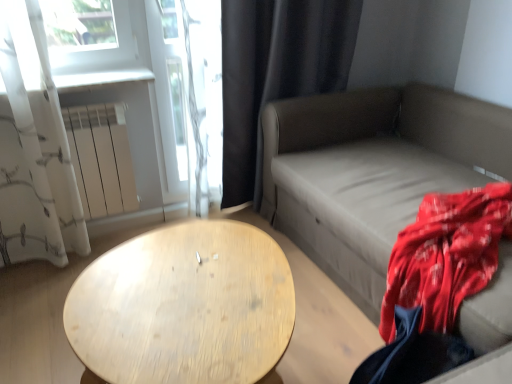
Question: Is black fabric curtain at upper right, the 2th curtain positioned from the left, thinner than matte gray couch at right?

Choices:
 (A) no
 (B) yes

Answer: (B)

Question: Is matte gray couch at right at the back of black fabric curtain at upper right, the 2th curtain positioned from the left?

Choices:
 (A) yes
 (B) no

Answer: (B)

Question: From a real-world perspective, is black fabric curtain at upper right, the first curtain viewed from the right, positioned over matte gray couch at right based on gravity?

Choices:
 (A) no
 (B) yes

Answer: (B)

Question: Could you tell me if black fabric curtain at upper right, the first curtain viewed from the right, is turned towards matte gray couch at right?

Choices:
 (A) no
 (B) yes

Answer: (B)

Question: From the image's perspective, would you say black fabric curtain at upper right, the 2th curtain positioned from the left, is shown under matte gray couch at right?

Choices:
 (A) no
 (B) yes

Answer: (A)

Question: Can you confirm if black fabric curtain at upper right, the first curtain viewed from the right, is smaller than matte gray couch at right?

Choices:
 (A) yes
 (B) no

Answer: (A)

Question: Is black fabric curtain at upper right, the first curtain viewed from the right, surrounding light wood/texture table at center?

Choices:
 (A) no
 (B) yes

Answer: (A)

Question: From the image's perspective, is black fabric curtain at upper right, the first curtain viewed from the right, below light wood/texture table at center?

Choices:
 (A) no
 (B) yes

Answer: (A)

Question: Is the position of black fabric curtain at upper right, the first curtain viewed from the right, less distant than that of light wood/texture table at center?

Choices:
 (A) no
 (B) yes

Answer: (A)

Question: From a real-world perspective, is black fabric curtain at upper right, the 2th curtain positioned from the left, positioned under light wood/texture table at center based on gravity?

Choices:
 (A) no
 (B) yes

Answer: (A)

Question: Considering the relative sizes of black fabric curtain at upper right, the first curtain viewed from the right, and light wood/texture table at center in the image provided, is black fabric curtain at upper right, the first curtain viewed from the right, taller than light wood/texture table at center?

Choices:
 (A) yes
 (B) no

Answer: (A)

Question: Is black fabric curtain at upper right, the first curtain viewed from the right, smaller than light wood/texture table at center?

Choices:
 (A) no
 (B) yes

Answer: (A)

Question: Is matte gray couch at right touching light wood/texture table at center?

Choices:
 (A) yes
 (B) no

Answer: (B)